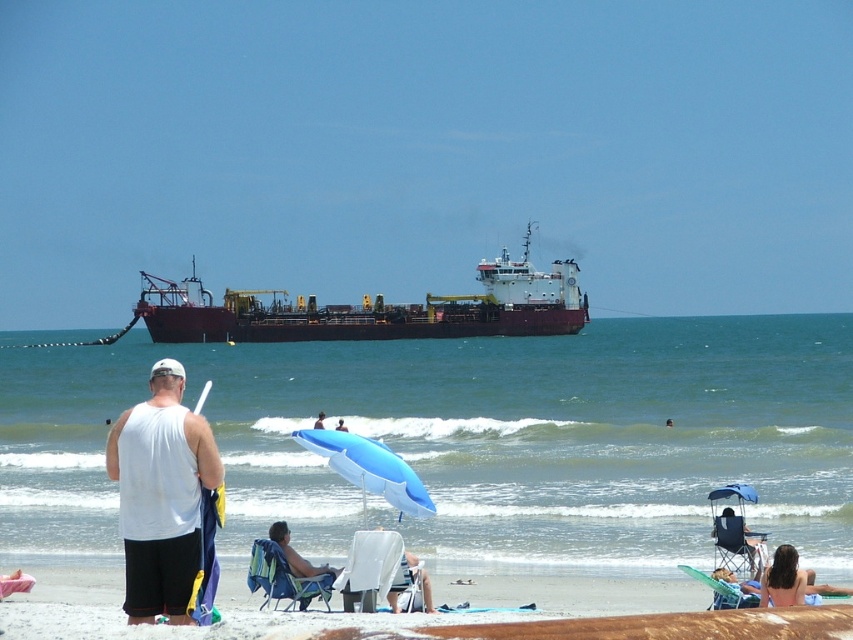
Question: Which point is farther to the camera?

Choices:
 (A) dark blue water at center
 (B) white fabric beach chair at lower center
 (C) blue fabric umbrella at center

Answer: (C)

Question: Which of the following is the farthest from the observer?

Choices:
 (A) (347, 429)
 (B) (399, 556)

Answer: (A)

Question: Which point is closer to the camera?

Choices:
 (A) [518, 298]
 (B) [376, 465]
 (C) [653, 346]
 (D) [206, 429]

Answer: (D)

Question: In this image, where is dark blue water at center located relative to smooth blue umbrella at center?

Choices:
 (A) above
 (B) below

Answer: (A)

Question: Is blue fabric beach chair at lower right bigger than blonde hair at lower right?

Choices:
 (A) no
 (B) yes

Answer: (B)

Question: Where is dark red matte ship at center located in relation to tan fabric chair at lower center in the image?

Choices:
 (A) below
 (B) above

Answer: (B)